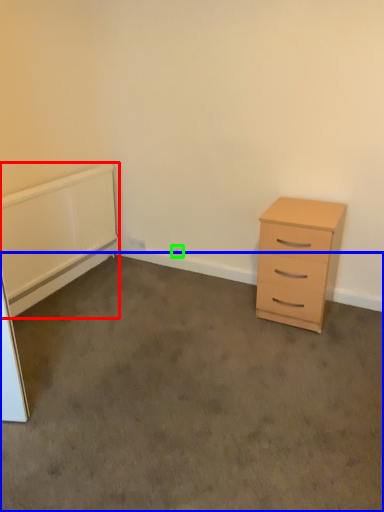
Question: Which is nearer to the radiator (highlighted by a red box)? plain (highlighted by a blue box) or electric outlet (highlighted by a green box).

Choices:
 (A) plain
 (B) electric outlet

Answer: (A)